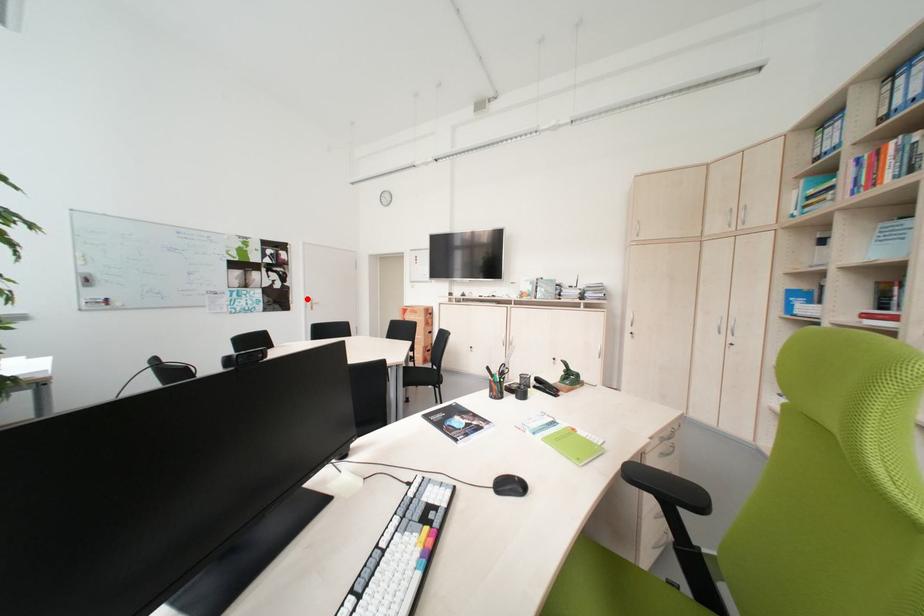
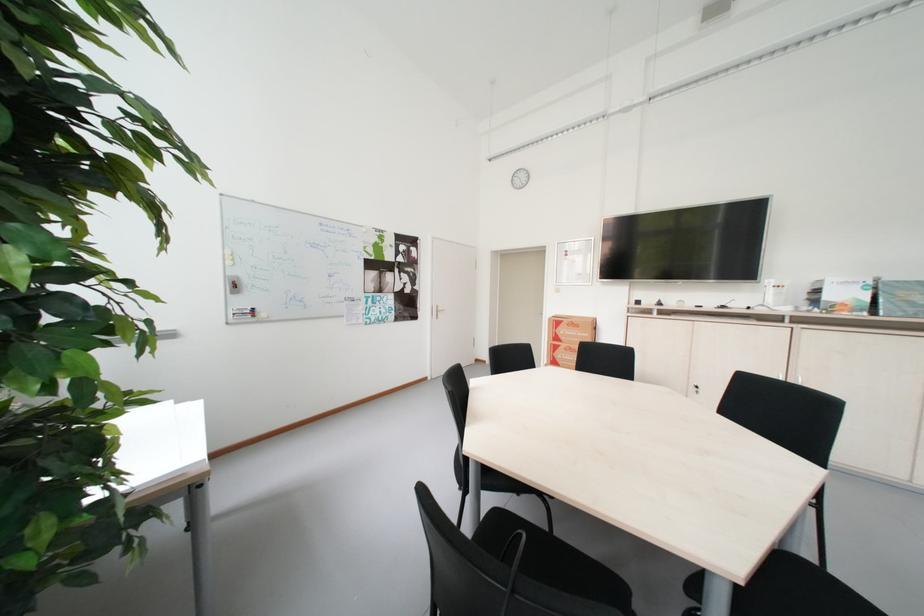
In the second image, find the point that corresponds to the highlighted location in the first image.

(434, 305)